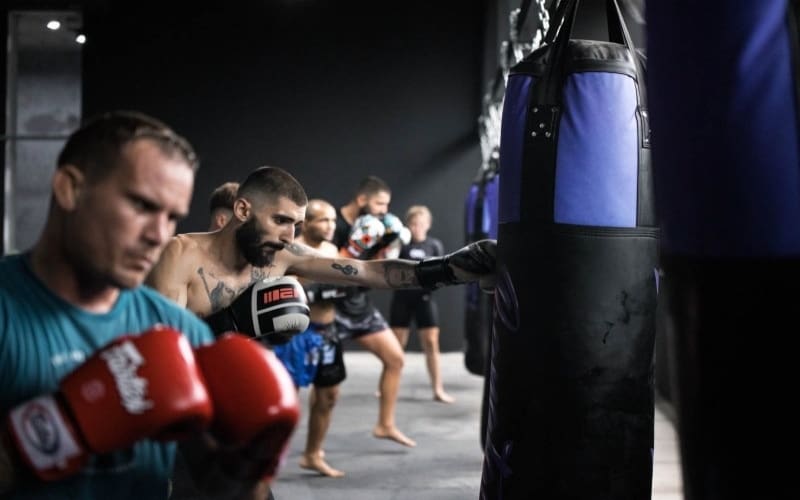
The image size is (800, 500). Find the location of `ceiling light`. ceiling light is located at coordinates (54, 27).